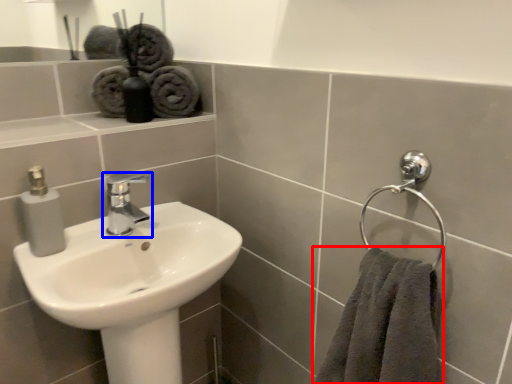
Question: Among these objects, which one is nearest to the camera, towel (highlighted by a red box) or tap (highlighted by a blue box)?

Choices:
 (A) towel
 (B) tap

Answer: (A)